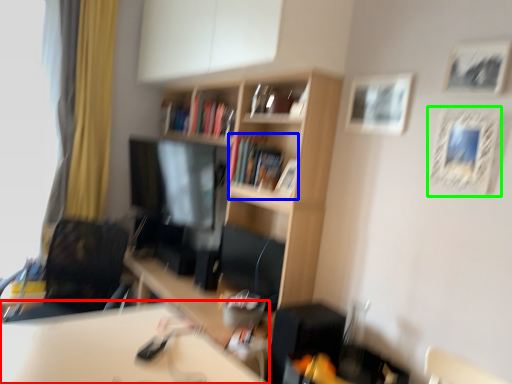
Question: Considering the real-world distances, which object is closest to table (highlighted by a red box)? book (highlighted by a blue box) or picture frame (highlighted by a green box).

Choices:
 (A) book
 (B) picture frame

Answer: (A)